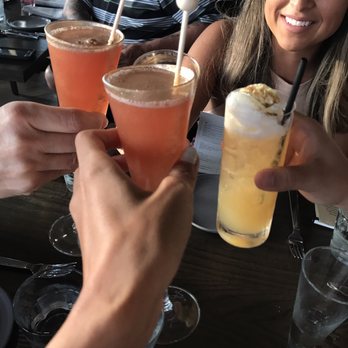
The height and width of the screenshot is (348, 348). What are the coordinates of `forks` in the screenshot? It's located at (25, 267), (297, 234).